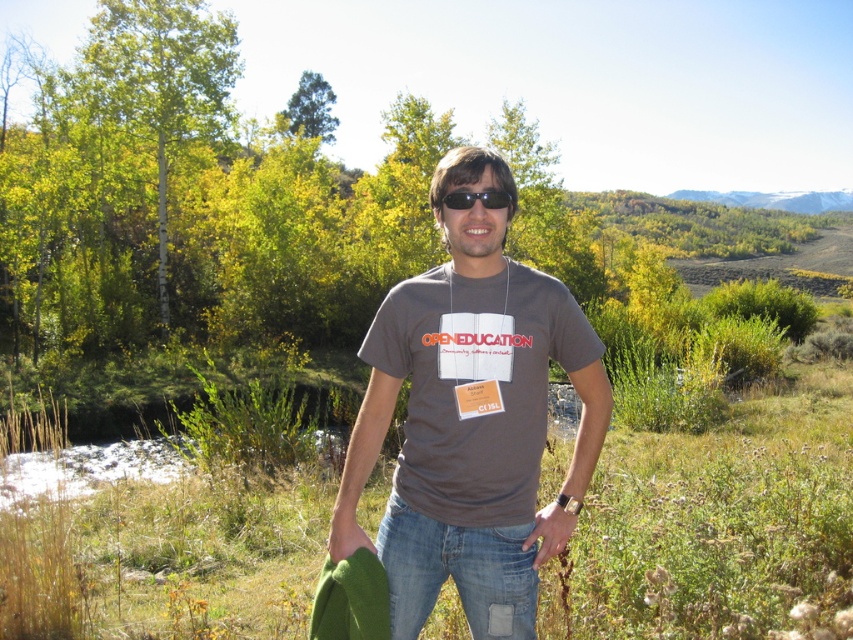
Is brown cotton t-shirt at center bigger than black plastic sunglasses at center?

Correct, brown cotton t-shirt at center is larger in size than black plastic sunglasses at center.

Which is above, brown cotton t-shirt at center or black plastic sunglasses at center?

black plastic sunglasses at center is higher up.

Identify the location of brown cotton t-shirt at center. The image size is (853, 640). coord(471,419).